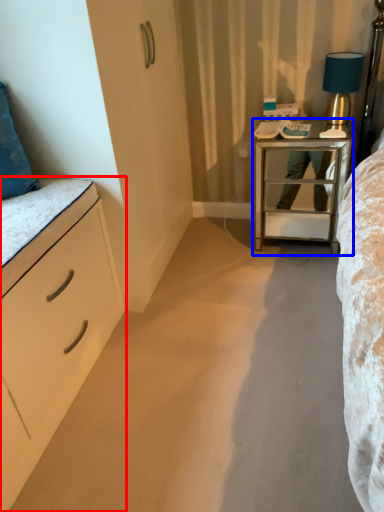
Question: Which object appears closest to the camera in this image, chest of drawers (highlighted by a red box) or nightstand (highlighted by a blue box)?

Choices:
 (A) chest of drawers
 (B) nightstand

Answer: (A)